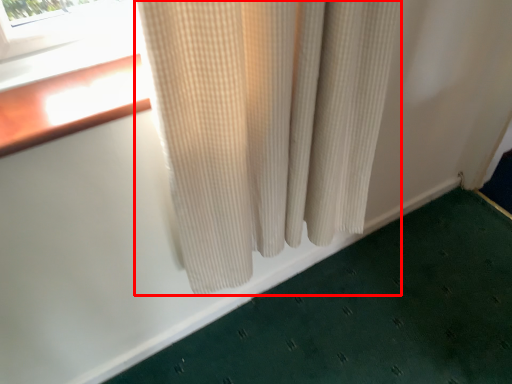
Question: From the image's perspective, where is curtain (annotated by the red box) located relative to bath mat?

Choices:
 (A) above
 (B) below

Answer: (A)